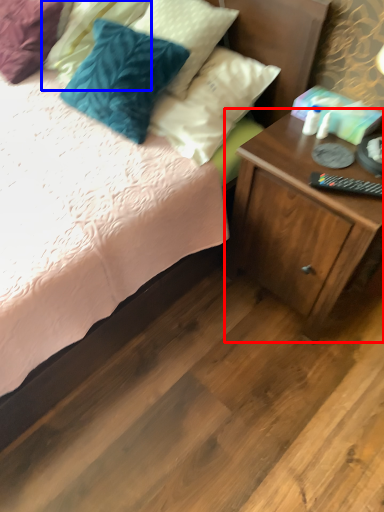
Question: Which object is closer to the camera taking this photo, nightstand (highlighted by a red box) or pillow (highlighted by a blue box)?

Choices:
 (A) nightstand
 (B) pillow

Answer: (A)